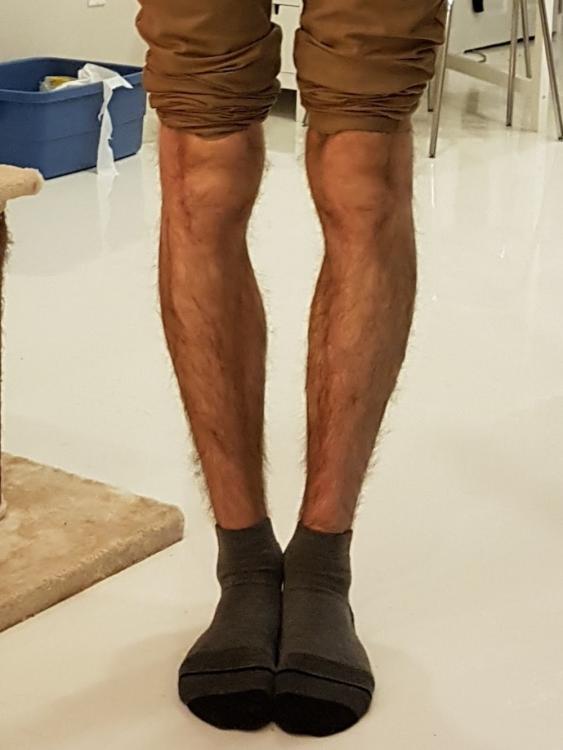
This screenshot has width=563, height=750. I want to click on carpet square on wood, so click(82, 535), click(64, 542).